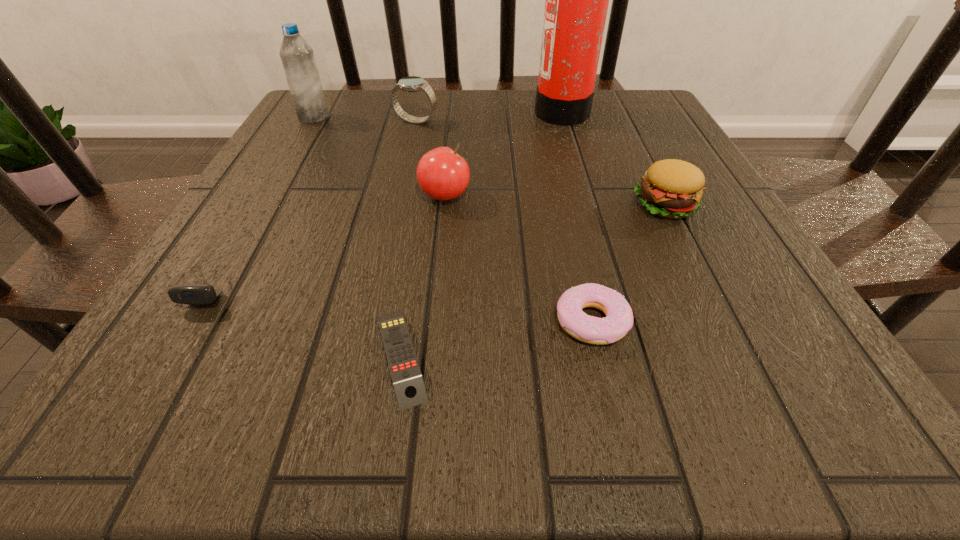
I want to click on fire extinguisher, so click(576, 0).

Locate an element on the screen. The height and width of the screenshot is (540, 960). water bottle is located at coordinates tap(297, 57).

Where is `watch`? The width and height of the screenshot is (960, 540). watch is located at coordinates (411, 83).

Locate an element on the screen. apple is located at coordinates (442, 174).

This screenshot has height=540, width=960. In order to click on hamburger in this screenshot , I will do `click(670, 188)`.

Image resolution: width=960 pixels, height=540 pixels. I want to click on the fourth shortest object, so click(670, 188).

This screenshot has width=960, height=540. Identify the location of webcam. (194, 294).

Locate an element on the screen. The width and height of the screenshot is (960, 540). the second shortest object is located at coordinates point(619,317).

Where is `remote control`? This screenshot has width=960, height=540. remote control is located at coordinates (409, 387).

You are a GUI agent. You are given a task and a screenshot of the screen. Output one action in this format:
    pyautogui.click(x=<x>, y=<y>)
    Task: Click on the vacant point located 0.100m on the front side of the tallest object
    The height and width of the screenshot is (540, 960).
    Given the screenshot: What is the action you would take?
    pyautogui.click(x=493, y=111)